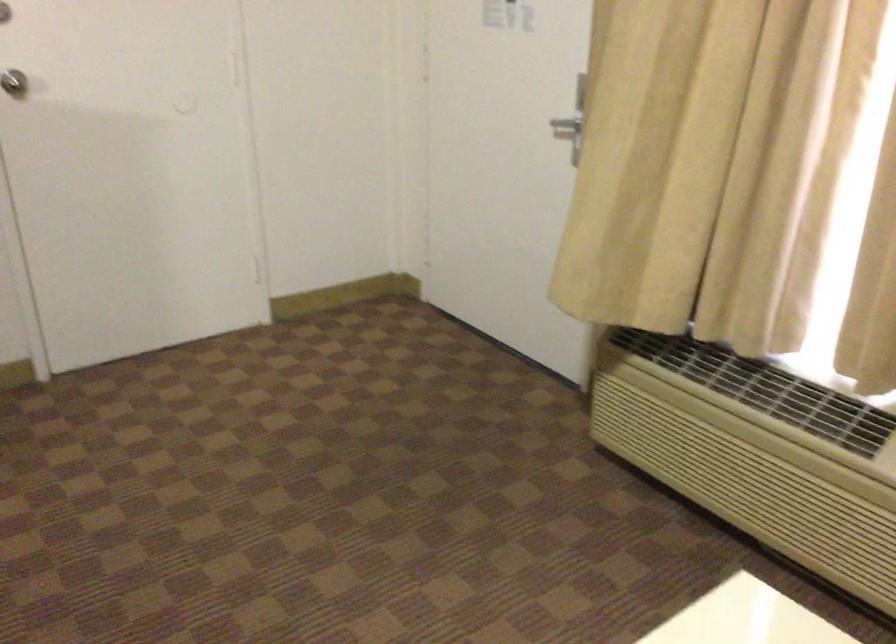
I want to click on silver door handle, so click(572, 120).